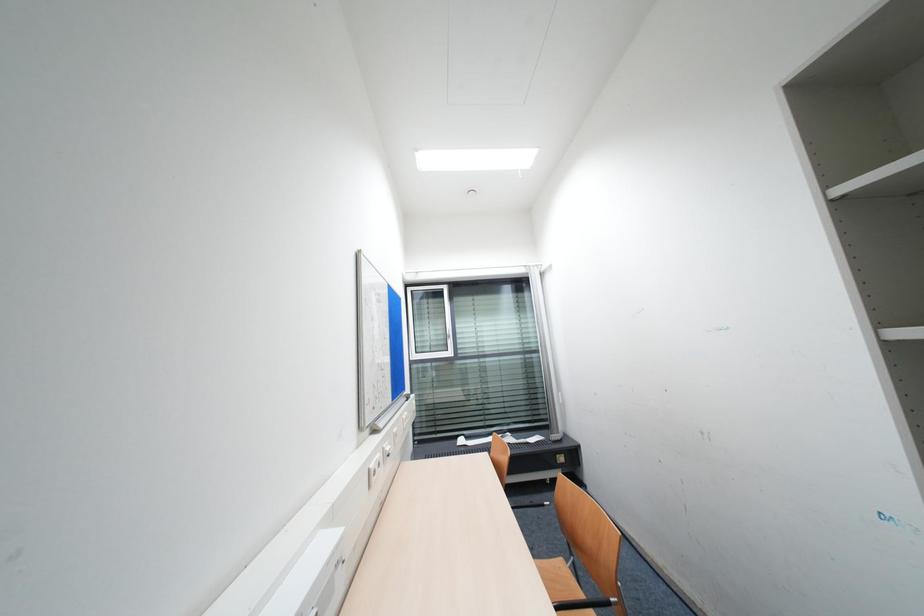
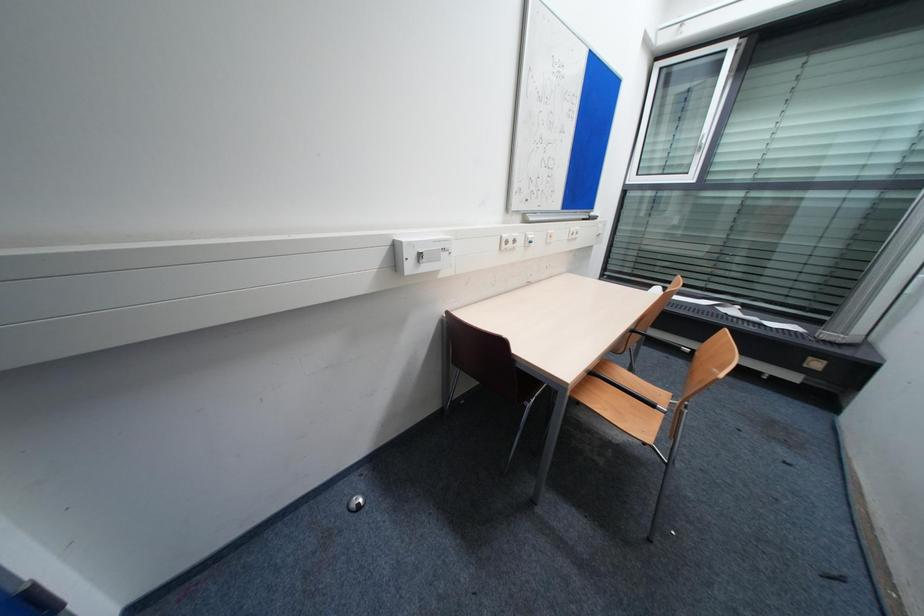
The first image is from the beginning of the video and the second image is from the end. How did the camera likely rotate when shooting the video?

The camera's rotation is toward left-down.